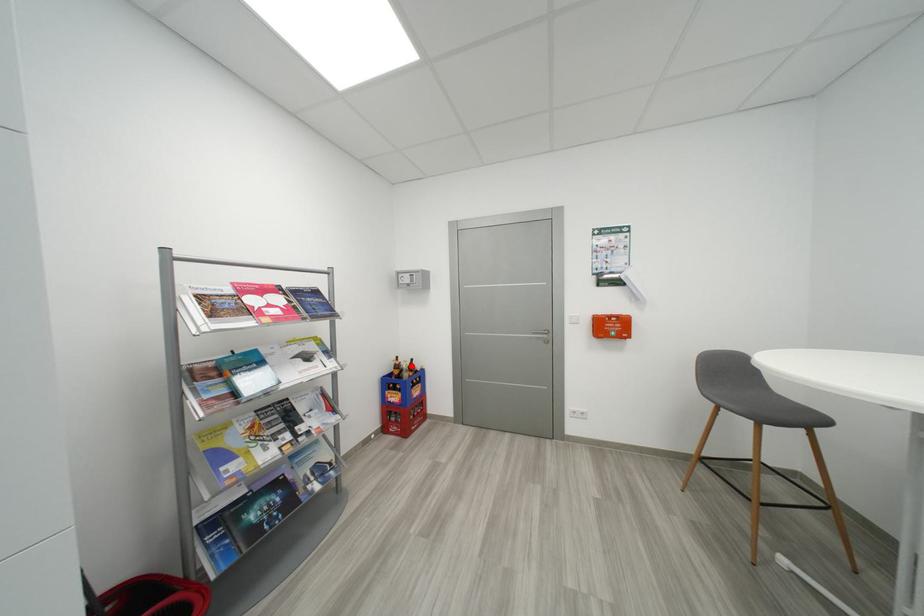
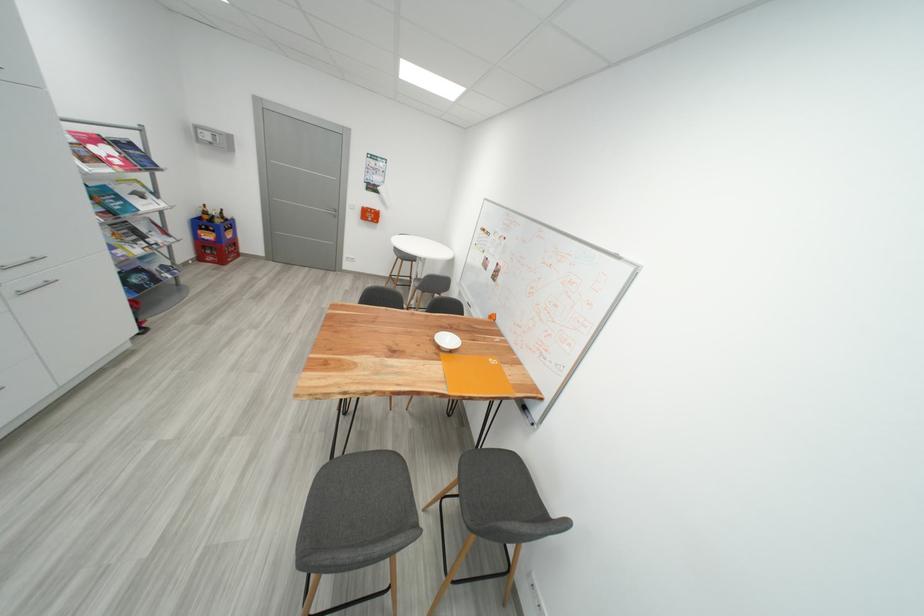
Question: I am providing you with two images of the same scene from different viewpoints. Given a red point in image1, look at the same physical point in image2. Is it:

Choices:
 (A) Closer to the viewpoint
 (B) Farther from the viewpoint

Answer: (A)